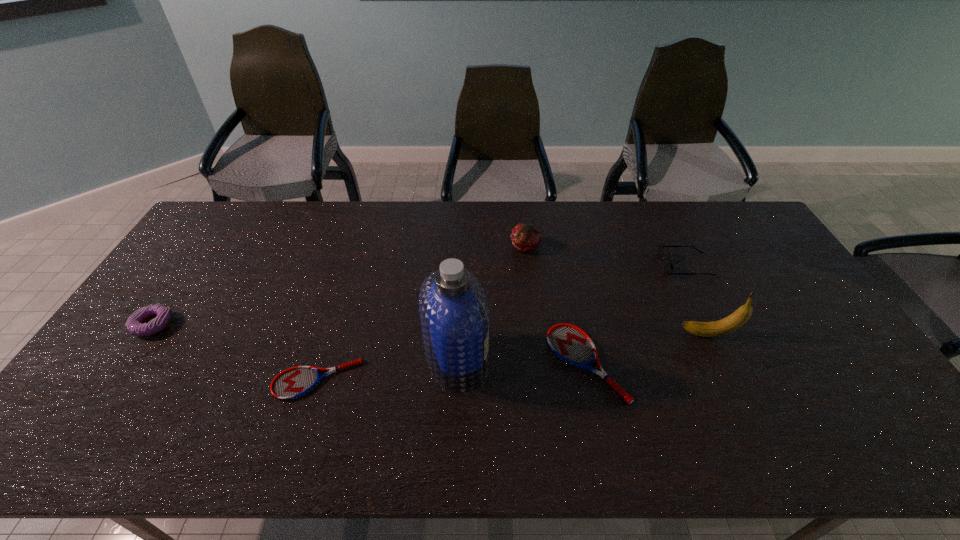
With all tennis rackets evenly spaced, where should an extra tennis racket be placed on the right to continue the pattern? Please point out a vacant space. Please provide its 2D coordinates. Your answer should be formatted as a tuple, i.e. [(x, y)], where the tuple contains the x and y coordinates of a point satisfying the conditions above.

[(838, 347)]